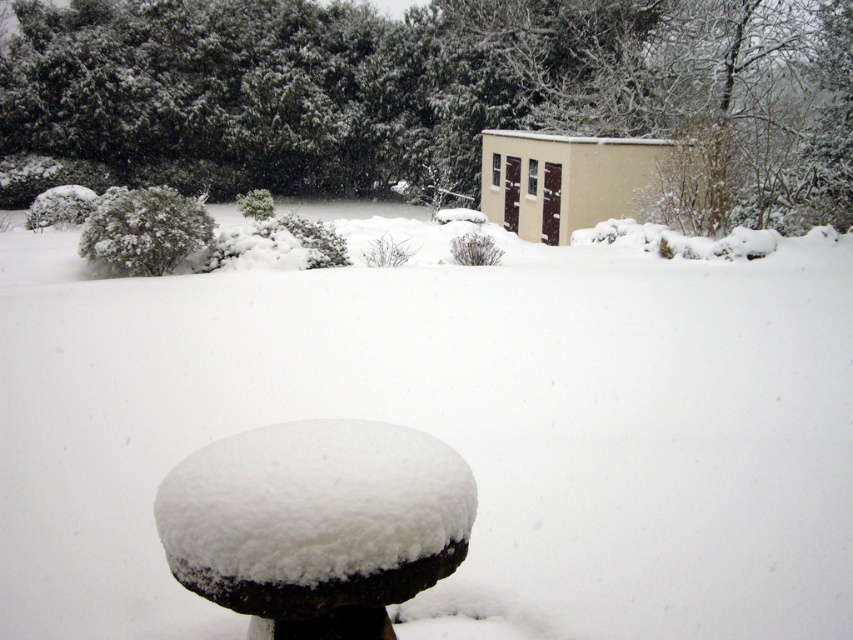
What is the 2D coordinate of the green leafy tree at upper center?

The green leafy tree at upper center is located at the 2D coordinate point of (440, 93).